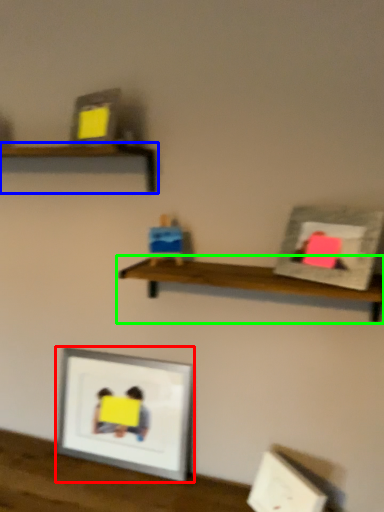
Question: Considering the real-world distances, which object is farthest from picture frame (highlighted by a red box)? shelf (highlighted by a blue box) or shelf (highlighted by a green box)?

Choices:
 (A) shelf
 (B) shelf

Answer: (A)